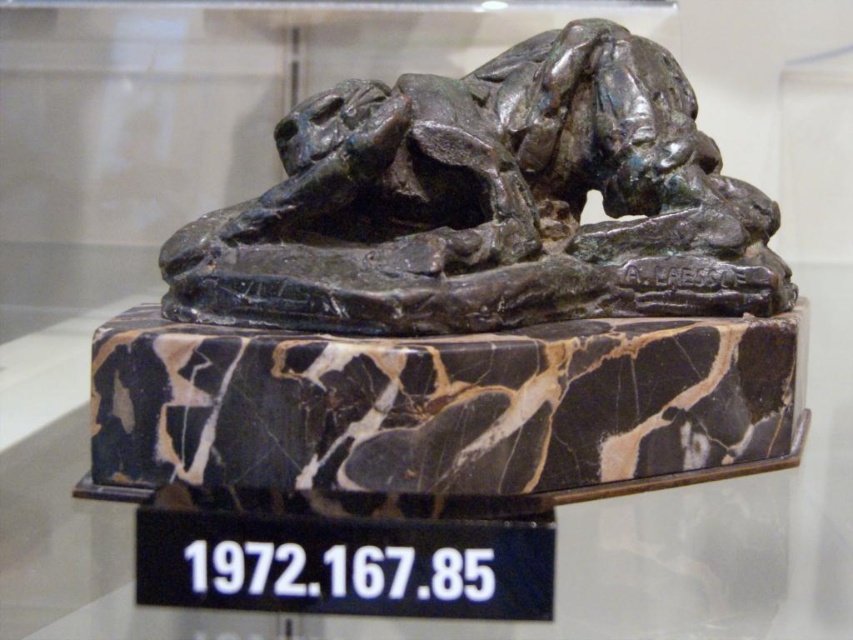
Based on the photo, does bronze sculpture at center lie behind marble at center?

No, bronze sculpture at center is closer to the viewer.

Between bronze sculpture at center and marble at center, which one is positioned higher?

Positioned higher is bronze sculpture at center.

Which is behind, point (672, 412) or point (300, 480)?

The point (672, 412) is more distant.

The image size is (853, 640). Find the location of `bronze sculpture at center`. bronze sculpture at center is located at coordinates (466, 284).